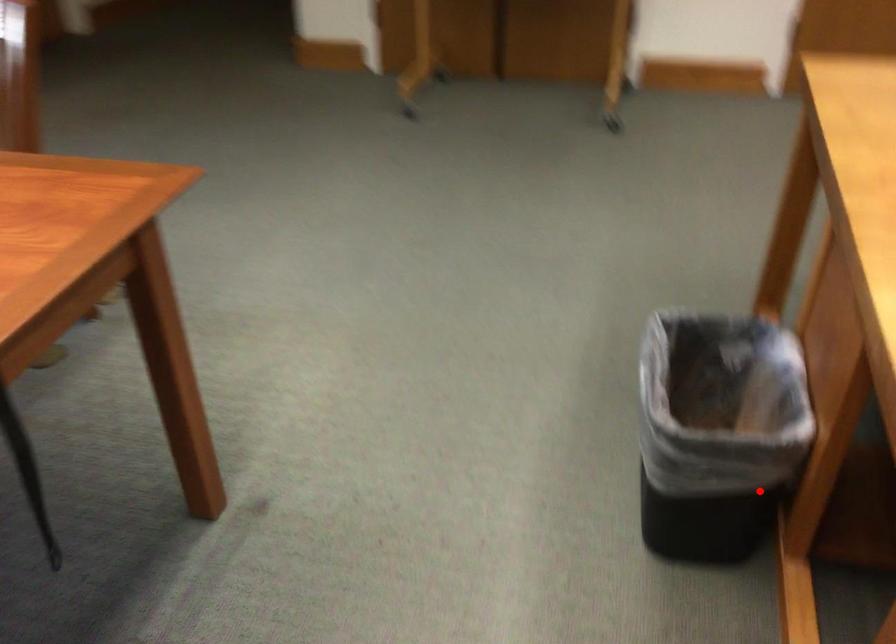
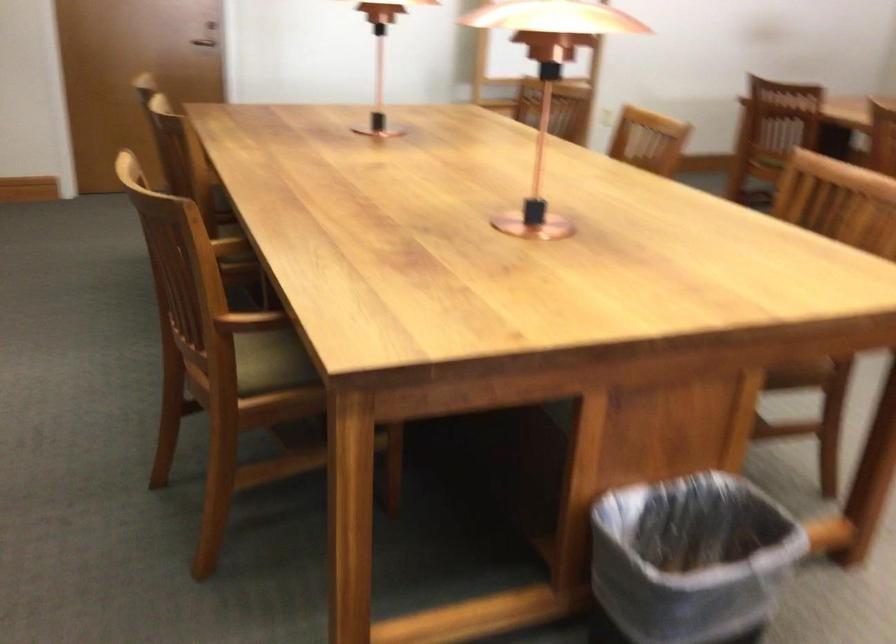
Question: I am providing you with two images of the same scene from different viewpoints. A red point is shown in image1. For the corresponding object point in image2, is it positioned nearer or farther from the camera?

Choices:
 (A) Nearer
 (B) Farther

Answer: (B)